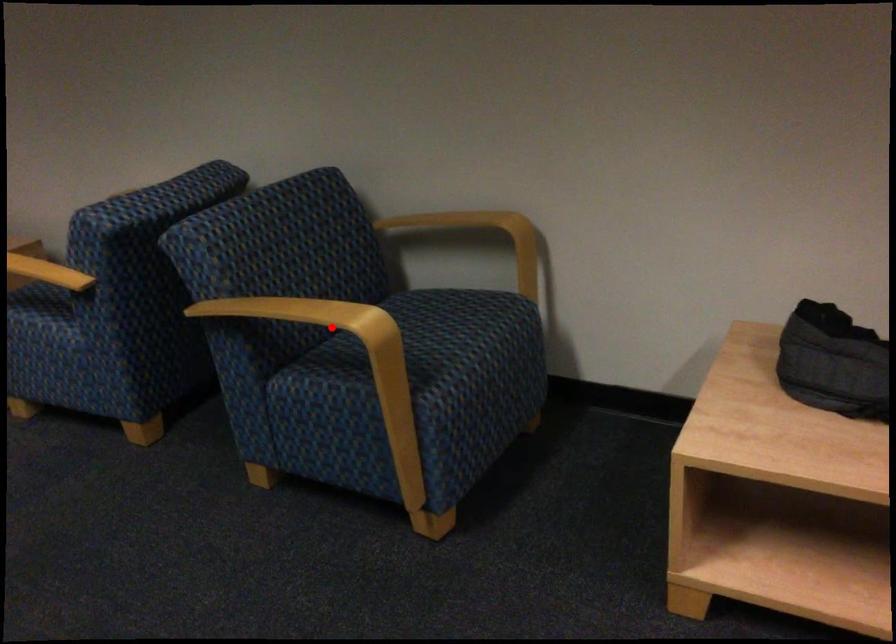
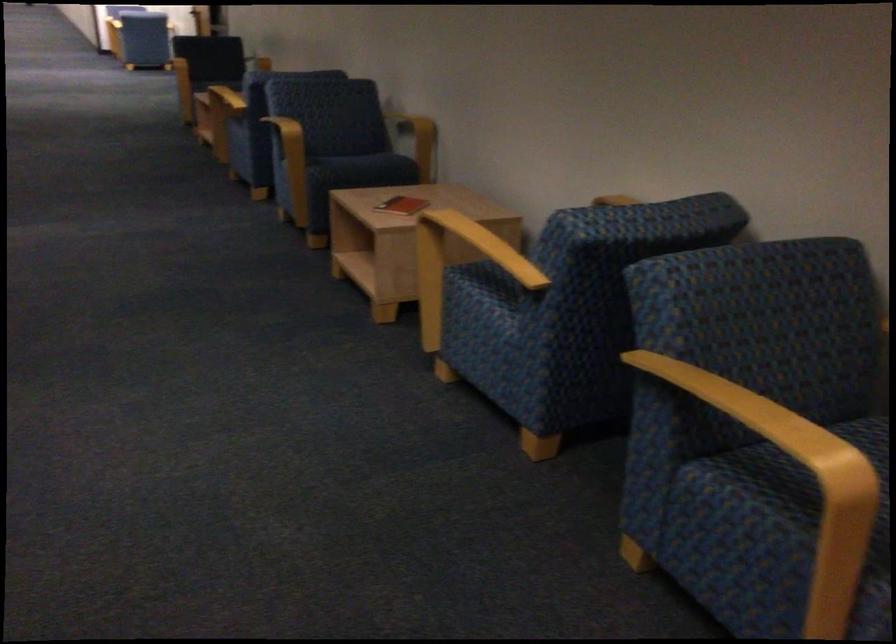
In the second image, find the point that corresponds to the highlighted location in the first image.

(787, 446)